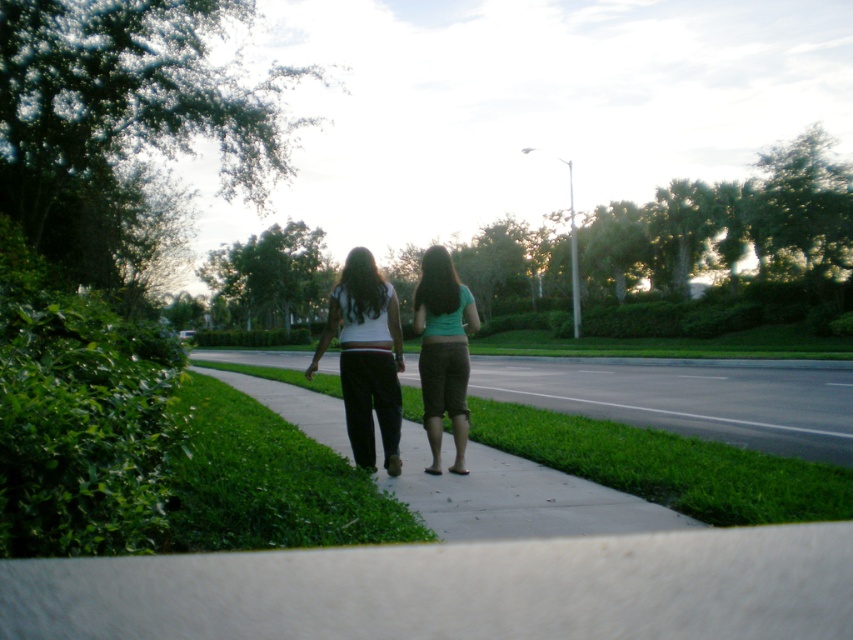
Question: Does green grass at lower left have a smaller size compared to green fabric pants at center?

Choices:
 (A) no
 (B) yes

Answer: (A)

Question: Estimate the real-world distances between objects in this image. Which object is closer to the green fabric pants at center?

Choices:
 (A) white matte pants at center
 (B) green grass at lower left

Answer: (A)

Question: Is smooth concrete sidewalk at center below white matte pants at center?

Choices:
 (A) yes
 (B) no

Answer: (A)

Question: Which point is closer to the camera taking this photo?

Choices:
 (A) (392, 540)
 (B) (352, 440)

Answer: (A)

Question: Which point appears farthest from the camera in this image?

Choices:
 (A) (190, 458)
 (B) (459, 332)
 (C) (560, 365)

Answer: (C)

Question: Can you confirm if smooth concrete sidewalk at center is smaller than white matte pants at center?

Choices:
 (A) yes
 (B) no

Answer: (B)